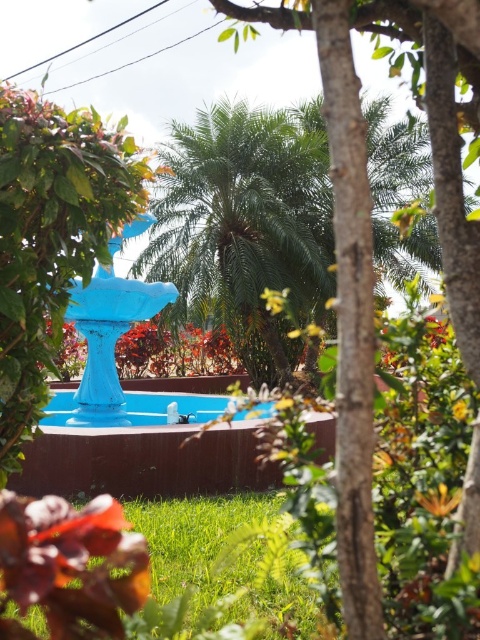
Image resolution: width=480 pixels, height=640 pixels. Describe the element at coordinates (243, 227) in the screenshot. I see `green leafy palm at center` at that location.

Is green leafy palm at center thinner than blue glossy pool at center?

Yes.

Does point (266, 220) come behind point (214, 401)?

Yes, it is.

The width and height of the screenshot is (480, 640). What are the coordinates of `green leafy palm at center` in the screenshot? It's located at point(243,227).